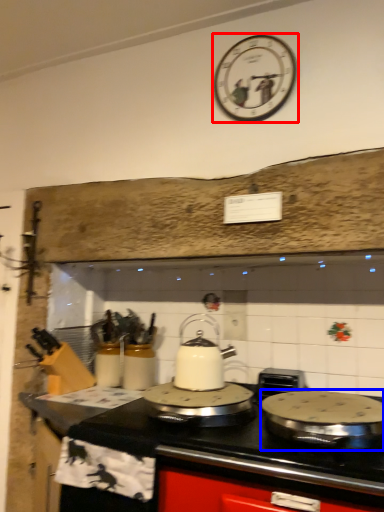
Question: Which object appears farthest to the camera in this image, wall clock (highlighted by a red box) or kitchen appliance (highlighted by a blue box)?

Choices:
 (A) wall clock
 (B) kitchen appliance

Answer: (A)